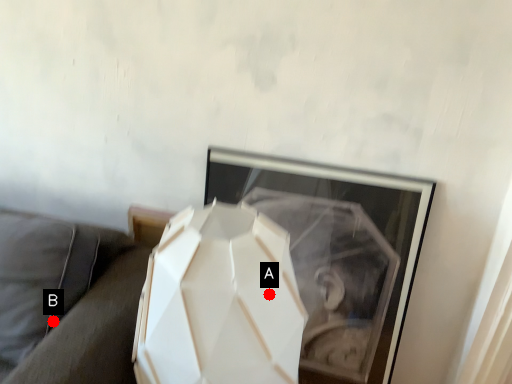
Question: Two points are circled on the image, labeled by A and B beside each circle. Which point is closer to the camera?

Choices:
 (A) A is closer
 (B) B is closer

Answer: (A)